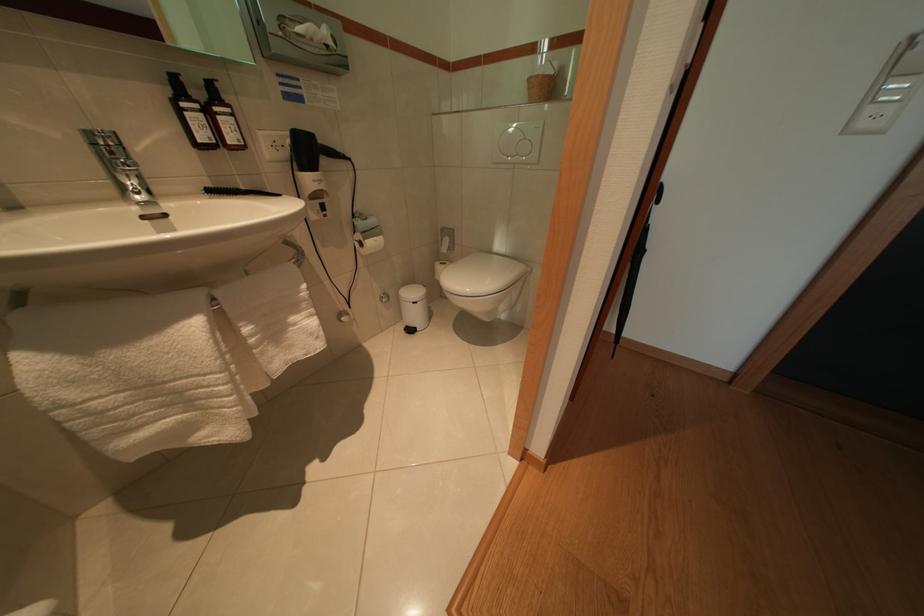
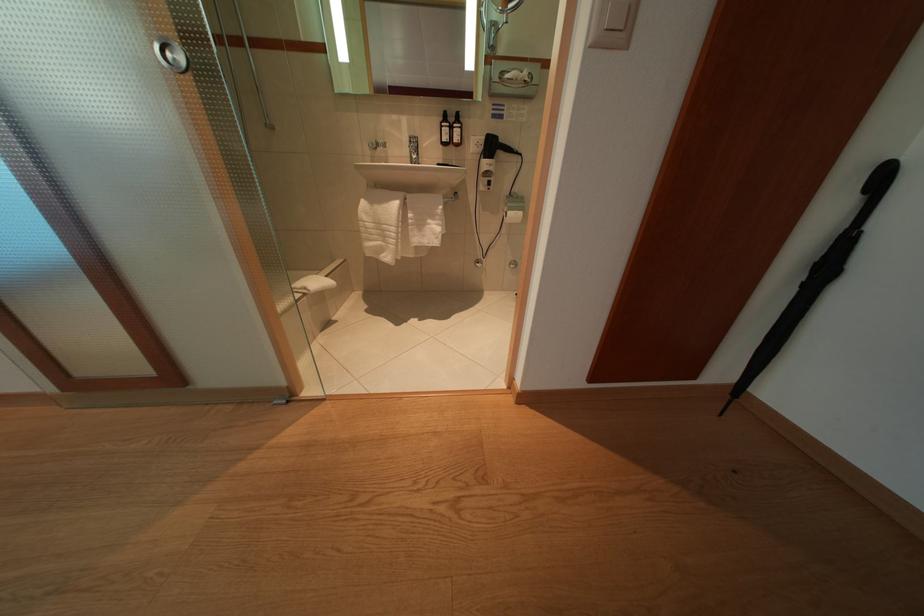
The point at [99,140] is marked in the first image. Where is the corresponding point in the second image?

(419, 143)